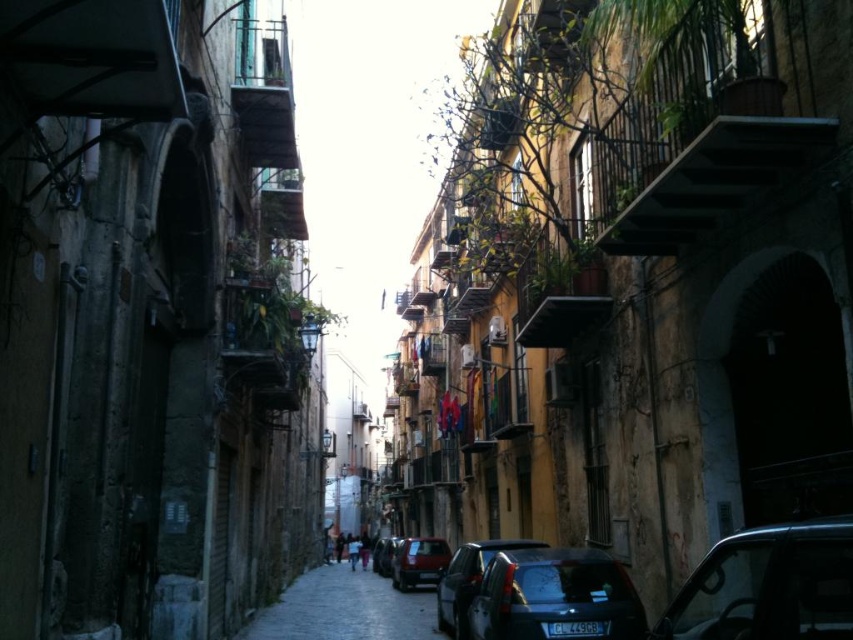
Can you confirm if shiny black car at lower right is positioned to the right of shiny blue car at lower center?

Correct, you'll find shiny black car at lower right to the right of shiny blue car at lower center.

Can you confirm if shiny black car at lower right is positioned above shiny blue car at lower center?

Yes, shiny black car at lower right is above shiny blue car at lower center.

Does point (738, 538) come farther from viewer compared to point (456, 616)?

No.

Identify the location of shiny black car at lower right. Image resolution: width=853 pixels, height=640 pixels. (769, 586).

Can you confirm if matte red car at center is wider than shiny black car at center?

In fact, matte red car at center might be narrower than shiny black car at center.

Who is more distant from viewer, (410, 579) or (378, 561)?

Positioned behind is point (378, 561).

Is point (445, 550) closer to viewer compared to point (383, 573)?

Yes, point (445, 550) is in front of point (383, 573).

You are a GUI agent. You are given a task and a screenshot of the screen. Output one action in this format:
    pyautogui.click(x=<x>, y=<y>)
    Task: Click on the matte red car at center
    The width and height of the screenshot is (853, 640).
    Given the screenshot: What is the action you would take?
    pyautogui.click(x=418, y=561)

This screenshot has width=853, height=640. Describe the element at coordinates (345, 609) in the screenshot. I see `dark gray cobblestone alley at center` at that location.

Which is more to the right, dark gray cobblestone alley at center or shiny black car at center?

shiny black car at center is more to the right.

Is point (341, 568) positioned behind point (392, 570)?

Yes, it is behind point (392, 570).

Where is `dark gray cobblestone alley at center`? dark gray cobblestone alley at center is located at coordinates (345, 609).